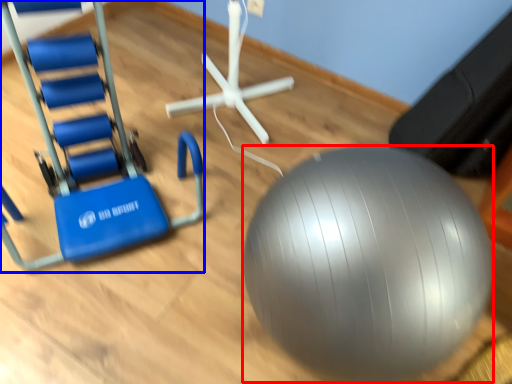
Question: Which of the following is the farthest to the observer, ball (highlighted by a red box) or swivel chair (highlighted by a blue box)?

Choices:
 (A) ball
 (B) swivel chair

Answer: (B)